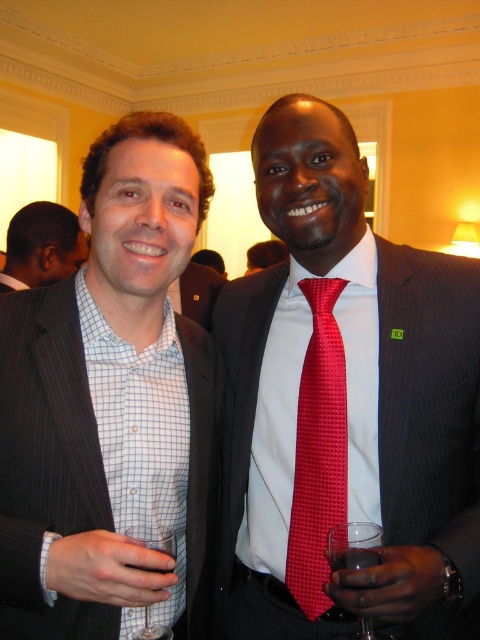
You are standing at a formal event and see the matte black suit at center. If you want to approach it without getting too close, what is the minimum distance you should maintain?

The minimum distance you should maintain is 30.01 inches to avoid getting too close to the matte black suit at center.

You are at a formal event and need to hand a document to the person on the right. The document must be placed in front of their red textured tie at center without touching the clear glass at lower left. Is this possible?

The clear glass at lower left is behind the red textured tie at center, so placing the document in front of the red textured tie at center would not interfere with the clear glass at lower left. Yes, it is possible to place the document there without touching the glass.